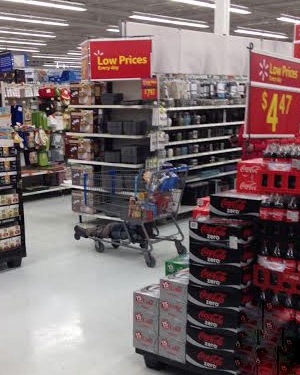
The height and width of the screenshot is (375, 300). Identify the location of ceiling. (86, 21).